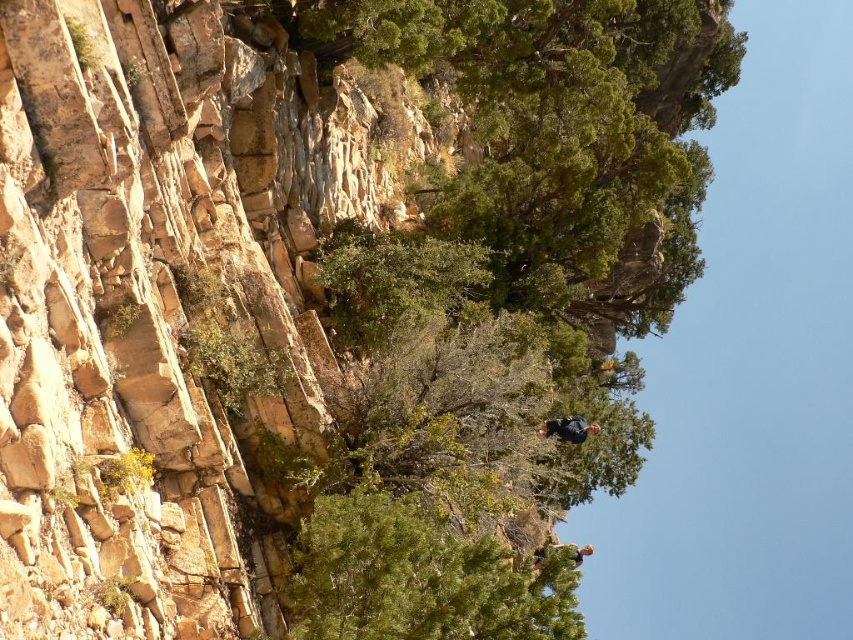
Can you confirm if green leafy tree at center is positioned to the right of green fabric climber at lower center?

Incorrect, green leafy tree at center is not on the right side of green fabric climber at lower center.

Which of these two, green leafy tree at center or green fabric climber at lower center, stands taller?

green leafy tree at center

Does point (415, 614) lie in front of point (532, 566)?

Yes, it is.

You are a GUI agent. You are given a task and a screenshot of the screen. Output one action in this format:
    pyautogui.click(x=<x>, y=<y>)
    Task: Click on the green leafy tree at center
    This screenshot has width=853, height=640.
    Given the screenshot: What is the action you would take?
    pyautogui.click(x=505, y=298)

Who is more forward, (556, 429) or (554, 545)?

Point (556, 429) is in front.

Can you confirm if dark blue fabric at center is positioned above green fabric climber at lower center?

Correct, dark blue fabric at center is located above green fabric climber at lower center.

The image size is (853, 640). In order to click on dark blue fabric at center in this screenshot , I will do `click(569, 428)`.

Based on the photo, who is shorter, green leafy tree at center or dark blue fabric at center?

With less height is dark blue fabric at center.

Which is behind, point (305, 540) or point (548, 435)?

The point (548, 435) is more distant.

Locate an element on the screen. Image resolution: width=853 pixels, height=640 pixels. green leafy tree at center is located at coordinates click(505, 298).